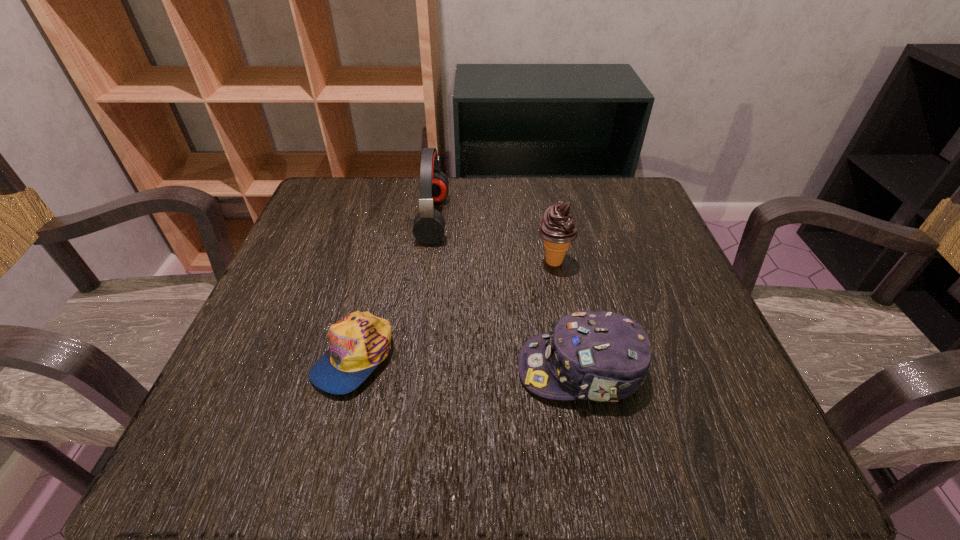
Locate an element on the screen. free region located on the front-facing side of the right cap is located at coordinates (411, 369).

Where is `free space located 0.250m on the front-facing side of the right cap`? Image resolution: width=960 pixels, height=540 pixels. free space located 0.250m on the front-facing side of the right cap is located at coordinates (361, 369).

This screenshot has height=540, width=960. In order to click on vacant space located on the bill of the left cap in this screenshot , I will do `click(331, 444)`.

I want to click on object located at the far edge, so click(x=429, y=224).

The height and width of the screenshot is (540, 960). Find the location of `object located at the left edge`. object located at the left edge is located at coordinates pos(360,341).

This screenshot has height=540, width=960. I want to click on object situated at the right edge, so click(601, 356).

Find the location of a particular element. free region at the far edge of the desktop is located at coordinates (561, 180).

In the image, there is a desktop. At what (x,y) coordinates should I click in order to perform the action: click on vacant region at the near edge. Please return your answer as a coordinate pair (x, y). This screenshot has width=960, height=540. Looking at the image, I should click on (540, 415).

I want to click on vacant region at the left edge of the desktop, so click(x=328, y=274).

Find the location of `blank space at the right edge`. blank space at the right edge is located at coordinates (598, 239).